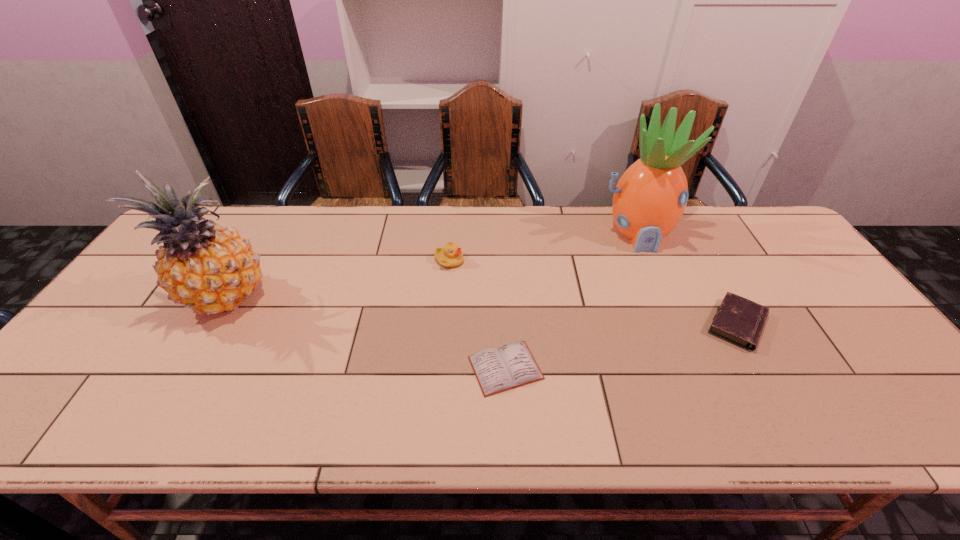
Locate an element on the screen. The image size is (960, 540). free point that satisfies the following two spatial constraints: 1. on the front-facing side of the duckling; 2. on the right side of the fourth tallest object is located at coordinates (444, 325).

Find the location of a particular element. This screenshot has height=540, width=960. free location that satisfies the following two spatial constraints: 1. on the front-facing side of the third tallest object; 2. on the right side of the left diary is located at coordinates (441, 368).